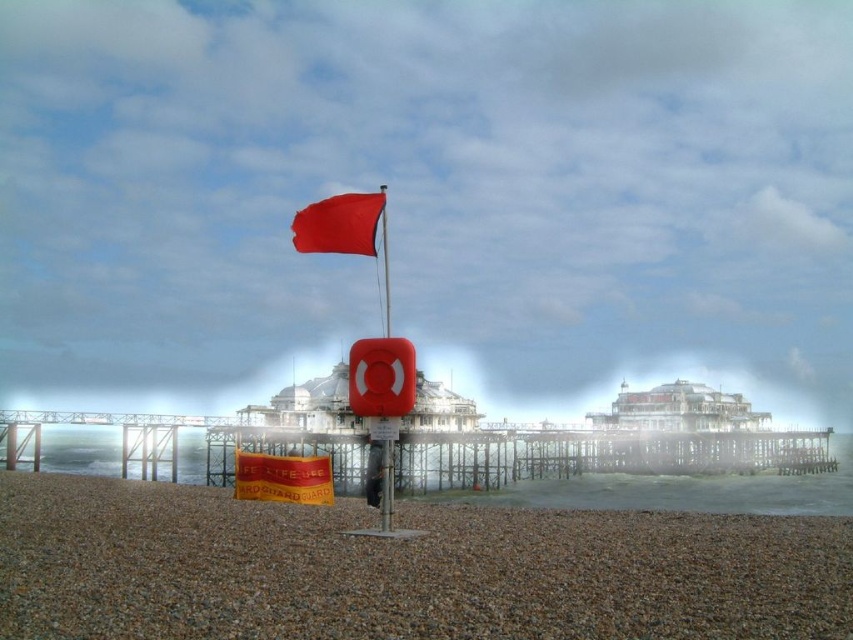
Between smooth pebble beach at center and matte red flag at center, which one appears on the right side from the viewer's perspective?

Positioned to the right is smooth pebble beach at center.

Between point (65, 483) and point (329, 228), which one is positioned in front?

Point (329, 228)

Locate an element on the screen. Image resolution: width=853 pixels, height=640 pixels. smooth pebble beach at center is located at coordinates (402, 570).

Is smooth pebble beach at center above smooth plastic flag at center?

Incorrect, smooth pebble beach at center is not positioned above smooth plastic flag at center.

Looking at this image, is smooth pebble beach at center closer to the viewer compared to smooth plastic flag at center?

Yes, it is.

This screenshot has height=640, width=853. I want to click on smooth pebble beach at center, so click(402, 570).

Is matte red flag at center positioned before smooth plastic flag at center?

No, it is behind smooth plastic flag at center.

The width and height of the screenshot is (853, 640). I want to click on matte red flag at center, so click(339, 225).